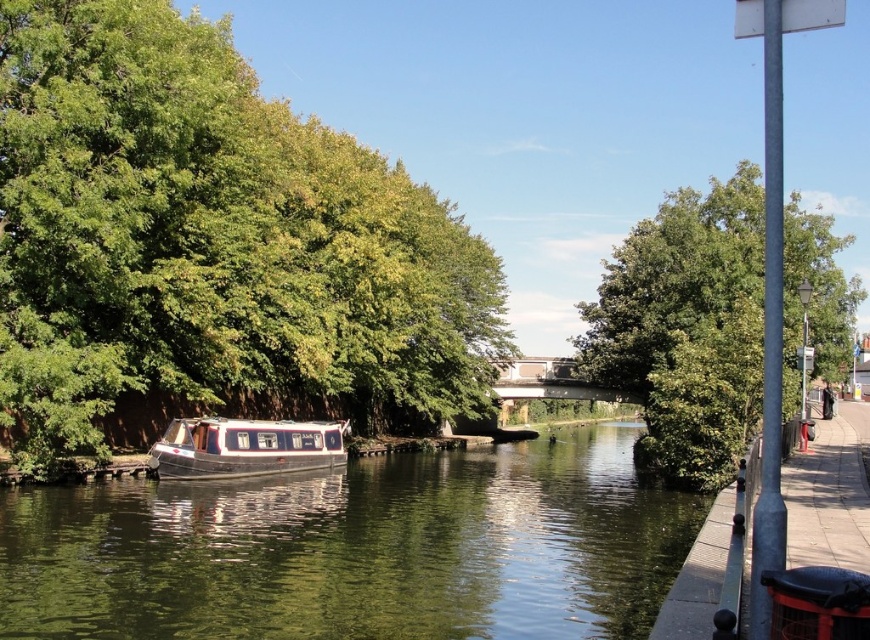
You are a photographer planning to take a photo of the white glossy boat at center from the right side of the canal. Considering the height of the green leafy tree at upper center, will the tree block your view of the boat?

The green leafy tree at upper center is much taller than the white glossy boat at center, so it may block part of the boat from your view.